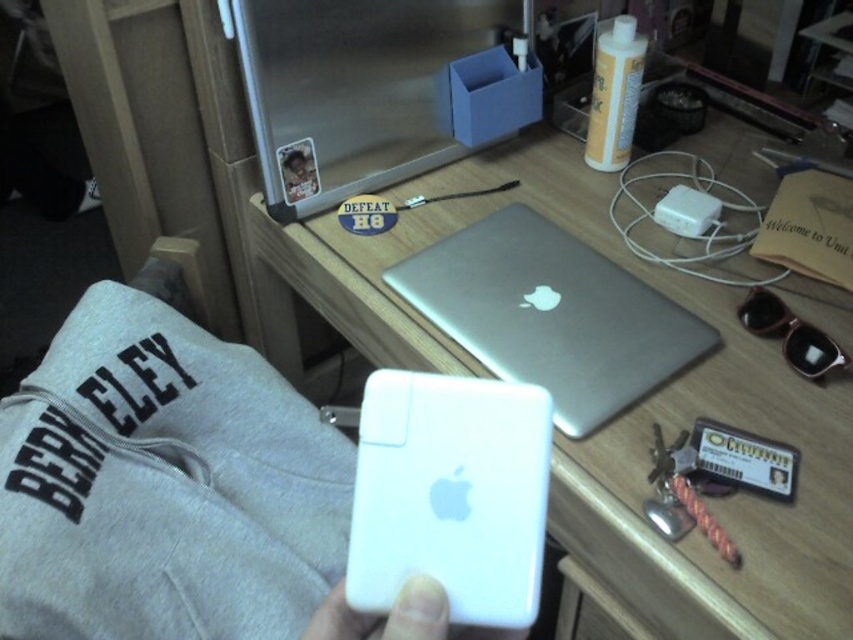
Question: Which point is closer to the camera?

Choices:
 (A) white plastic power bank at center
 (B) silver metallic laptop at center
 (C) wooden desk at center

Answer: (A)

Question: Can you confirm if wooden desk at center is smaller than white matte phone at center?

Choices:
 (A) yes
 (B) no

Answer: (B)

Question: Which object is positioned closest to the white plastic ipod at center?

Choices:
 (A) brushed metal drawer at lower center
 (B) white matte phone at center
 (C) white plastic power bank at center

Answer: (B)

Question: Is silver metallic laptop at center below brushed metal drawer at lower center?

Choices:
 (A) no
 (B) yes

Answer: (A)

Question: Which of the following is the closest to the observer?

Choices:
 (A) white matte phone at center
 (B) white plastic power bank at center
 (C) silver metallic laptop at center

Answer: (A)

Question: Is white plastic power bank at center to the left of white plastic ipod at center from the viewer's perspective?

Choices:
 (A) yes
 (B) no

Answer: (A)